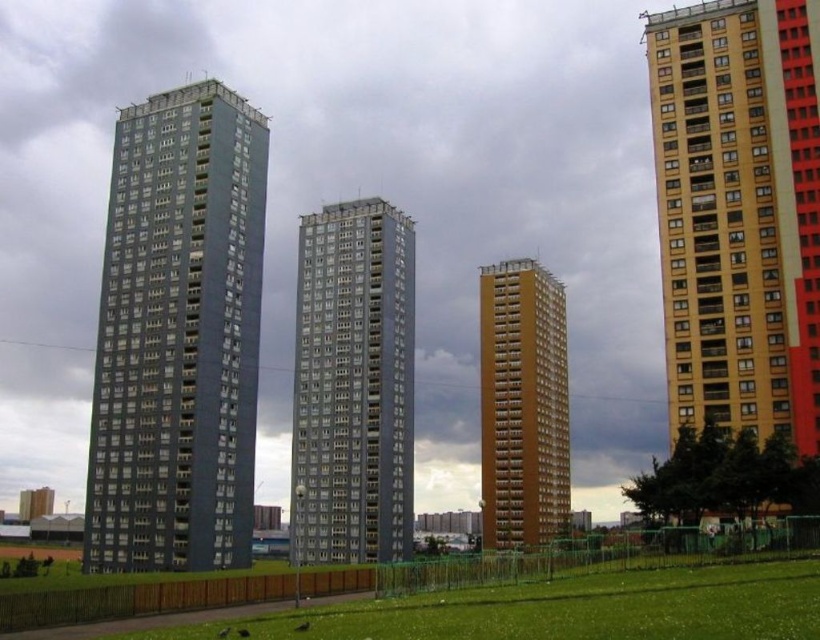
Question: Which object is positioned farthest from the brown matte building at center?

Choices:
 (A) gray concrete building at center
 (B) matte gray building at left
 (C) yellow matte building at right

Answer: (C)

Question: Is matte gray building at left closer to camera compared to green grass at lower center?

Choices:
 (A) no
 (B) yes

Answer: (A)

Question: Which point is farther to the camera?

Choices:
 (A) pos(265,630)
 (B) pos(700,131)
 (C) pos(137,321)

Answer: (C)

Question: Among these objects, which one is nearest to the camera?

Choices:
 (A) brown matte building at center
 (B) gray concrete building at center
 (C) green grass at lower center
 (D) yellow matte building at right

Answer: (C)

Question: From the image, what is the correct spatial relationship of gray concrete building at center in relation to brown matte building at center?

Choices:
 (A) above
 (B) below

Answer: (A)

Question: Observing the image, what is the correct spatial positioning of green grass at lower center in reference to brown matte building at center?

Choices:
 (A) below
 (B) above

Answer: (A)